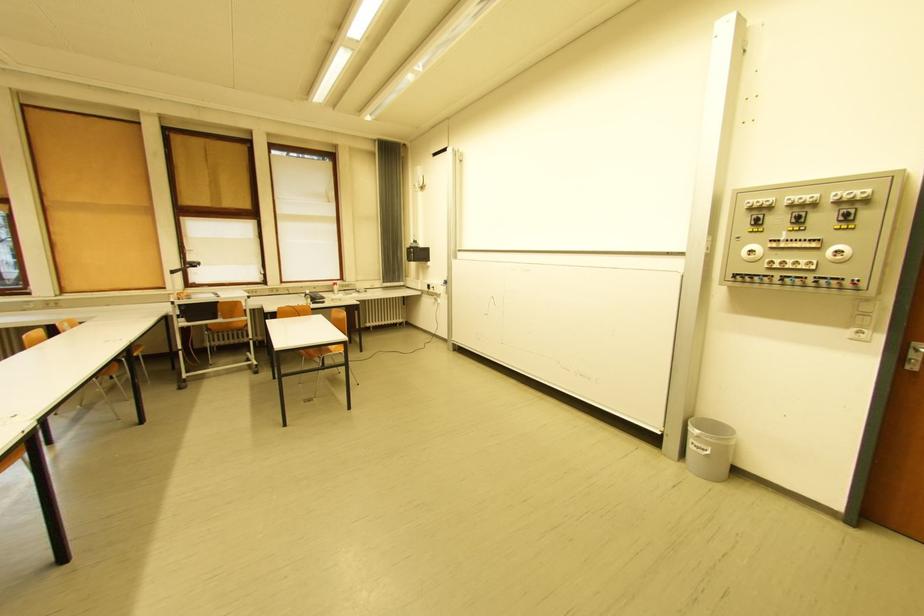
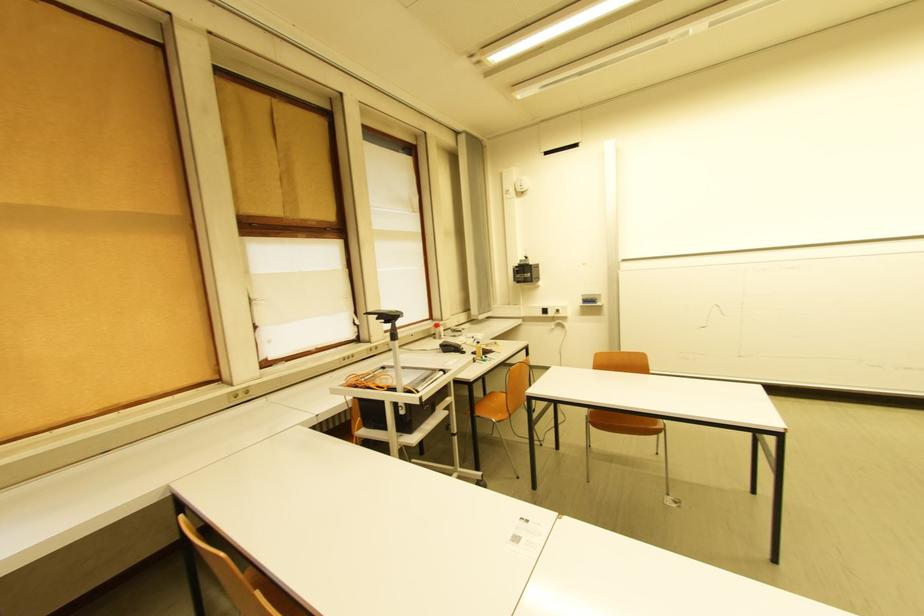
The images are taken continuously from a first-person perspective. In which direction are you moving?

The movement direction of the cameraman is left, forward.